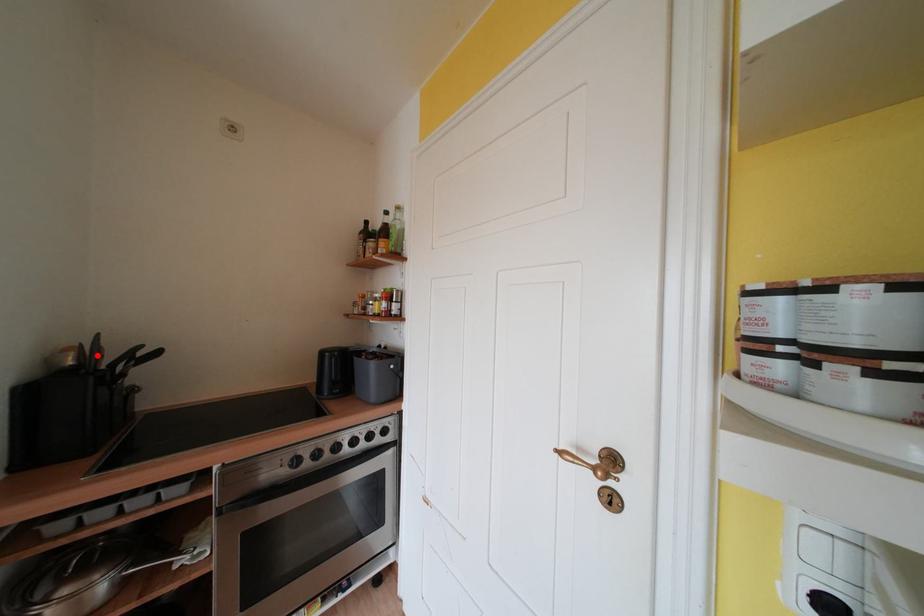
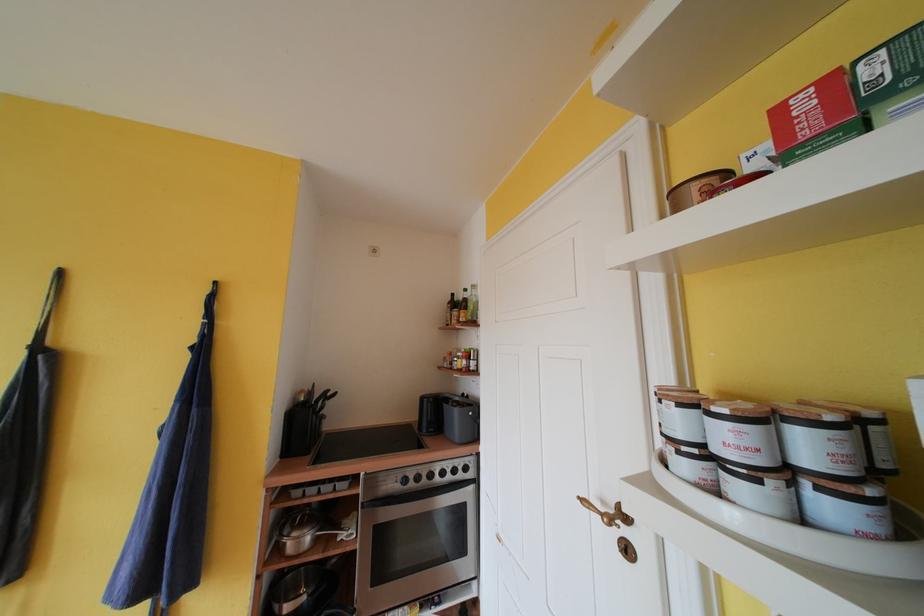
Where in the second image is the point corresponding to the highlighted location from the first image?

(315, 398)